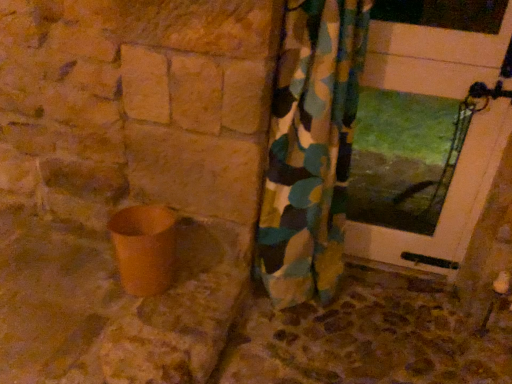
Question: From a real-world perspective, is brown stone concrete at lower center positioned under camouflage fabric curtain at center based on gravity?

Choices:
 (A) yes
 (B) no

Answer: (A)

Question: Is the position of brown stone concrete at lower center less distant than that of camouflage fabric curtain at center?

Choices:
 (A) no
 (B) yes

Answer: (A)

Question: Does brown stone concrete at lower center have a lesser width compared to camouflage fabric curtain at center?

Choices:
 (A) no
 (B) yes

Answer: (A)

Question: Is brown stone concrete at lower center next to camouflage fabric curtain at center?

Choices:
 (A) yes
 (B) no

Answer: (B)

Question: Is brown stone concrete at lower center facing towards camouflage fabric curtain at center?

Choices:
 (A) yes
 (B) no

Answer: (B)

Question: From the image's perspective, is brown stone concrete at lower center below camouflage fabric curtain at center?

Choices:
 (A) no
 (B) yes

Answer: (B)

Question: Is matte brown pot at lower left inside camouflage fabric curtain at center?

Choices:
 (A) no
 (B) yes

Answer: (A)

Question: Can you confirm if camouflage fabric curtain at center is taller than matte brown pot at lower left?

Choices:
 (A) no
 (B) yes

Answer: (B)

Question: Is camouflage fabric curtain at center thinner than matte brown pot at lower left?

Choices:
 (A) no
 (B) yes

Answer: (A)

Question: Can you confirm if camouflage fabric curtain at center is shorter than matte brown pot at lower left?

Choices:
 (A) no
 (B) yes

Answer: (A)

Question: From a real-world perspective, is camouflage fabric curtain at center positioned under matte brown pot at lower left based on gravity?

Choices:
 (A) no
 (B) yes

Answer: (A)

Question: From the image's perspective, does camouflage fabric curtain at center appear lower than matte brown pot at lower left?

Choices:
 (A) no
 (B) yes

Answer: (A)

Question: Does camouflage fabric curtain at center have a greater width compared to white glossy door at upper right?

Choices:
 (A) yes
 (B) no

Answer: (A)